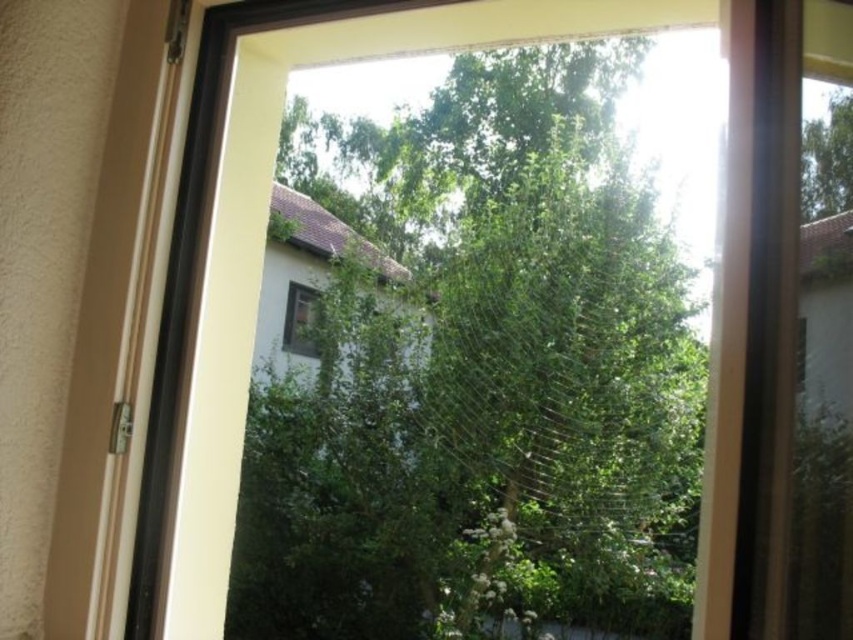
Question: Which point is farther to the camera?

Choices:
 (A) (526, 500)
 (B) (804, 172)
 (C) (305, 300)

Answer: (C)

Question: Can you confirm if green leafy tree at upper right is positioned above matte white window at center?

Choices:
 (A) yes
 (B) no

Answer: (A)

Question: Is green leafy tree at center smaller than green leafy tree at upper right?

Choices:
 (A) yes
 (B) no

Answer: (B)

Question: Which object is the closest to the green leafy tree at upper right?

Choices:
 (A) green leafy tree at center
 (B) matte white window at center

Answer: (A)

Question: Which of the following is the closest to the observer?

Choices:
 (A) (299, 323)
 (B) (439, 561)
 (C) (833, 125)

Answer: (C)

Question: Is green leafy tree at center positioned at the back of green leafy tree at upper right?

Choices:
 (A) no
 (B) yes

Answer: (B)